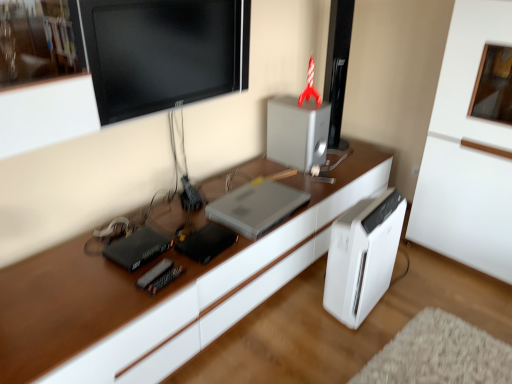
Question: Does black plastic router at left, placed as the 2th appliance when sorted from back to front, have a larger size compared to black glossy monitor at upper center?

Choices:
 (A) yes
 (B) no

Answer: (B)

Question: Does black plastic router at left, which is counted as the first appliance, starting from the left, come in front of black glossy monitor at upper center?

Choices:
 (A) yes
 (B) no

Answer: (B)

Question: Considering the relative sizes of black plastic router at left, placed as the 2th appliance when sorted from back to front, and black glossy monitor at upper center in the image provided, is black plastic router at left, placed as the 2th appliance when sorted from back to front, taller than black glossy monitor at upper center?

Choices:
 (A) no
 (B) yes

Answer: (A)

Question: Is black plastic router at left, placed as the 2th appliance when sorted from back to front, turned away from black glossy monitor at upper center?

Choices:
 (A) no
 (B) yes

Answer: (A)

Question: Can you see black plastic router at left, which ranks as the 2th appliance in right-to-left order, touching black glossy monitor at upper center?

Choices:
 (A) no
 (B) yes

Answer: (A)

Question: Is black plastic router at left, the 1th appliance from the bottom, spatially inside white plastic air purifier at lower right, or outside of it?

Choices:
 (A) inside
 (B) outside

Answer: (B)

Question: In terms of width, does black plastic router at left, the 1th appliance from the bottom, look wider or thinner when compared to white plastic air purifier at lower right?

Choices:
 (A) thin
 (B) wide

Answer: (A)

Question: From the image's perspective, relative to white plastic air purifier at lower right, is black plastic router at left, the 1th appliance from the bottom, above or below?

Choices:
 (A) below
 (B) above

Answer: (B)

Question: From a real-world perspective, relative to white plastic air purifier at lower right, is black plastic router at left, which is counted as the first appliance, starting from the left, vertically above or below?

Choices:
 (A) above
 (B) below

Answer: (A)

Question: Is point (117, 349) closer or farther from the camera than point (321, 105)?

Choices:
 (A) farther
 (B) closer

Answer: (B)

Question: From their relative heights in the image, would you say white glossy desk at center is taller or shorter than satin silver speaker at upper center, the 2th appliance when ordered from bottom to top?

Choices:
 (A) short
 (B) tall

Answer: (A)

Question: Is white glossy desk at center wider or thinner than satin silver speaker at upper center, the 2th appliance when ordered from bottom to top?

Choices:
 (A) thin
 (B) wide

Answer: (B)

Question: Do you think white glossy desk at center is within satin silver speaker at upper center, the 2th appliance when ordered from bottom to top, or outside of it?

Choices:
 (A) outside
 (B) inside

Answer: (A)

Question: From a real-world perspective, is satin silver laptop at center positioned above or below white glossy desk at center?

Choices:
 (A) above
 (B) below

Answer: (A)

Question: In terms of size, does satin silver laptop at center appear bigger or smaller than white glossy desk at center?

Choices:
 (A) small
 (B) big

Answer: (A)